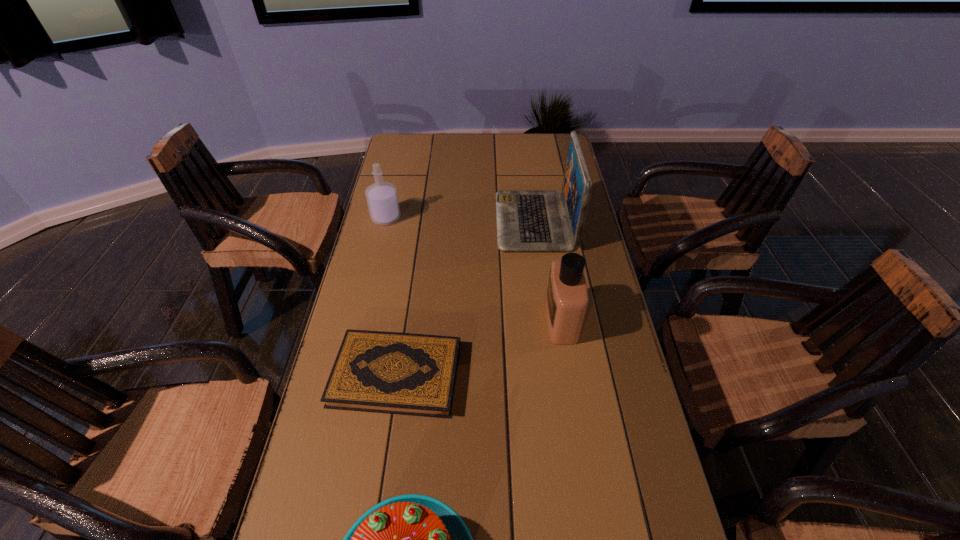
You are a GUI agent. You are given a task and a screenshot of the screen. Output one action in this format:
    pyautogui.click(x=<x>, y=<y>)
    Task: Click on the laptop computer
    
    Given the screenshot: What is the action you would take?
    pyautogui.click(x=527, y=220)

I want to click on the right perfume, so click(566, 303).

The width and height of the screenshot is (960, 540). Identify the location of the left perfume. (382, 199).

Locate an element on the screen. This screenshot has width=960, height=540. the shortest object is located at coordinates (412, 374).

Locate an element on the screen. free space located 0.280m on the screen of the laptop computer is located at coordinates (415, 221).

Find the location of a particular element. free space located on the screen of the laptop computer is located at coordinates coord(438,221).

Find the location of `vacant space situated 0.230m on the screen of the laptop computer`. vacant space situated 0.230m on the screen of the laptop computer is located at coordinates (429, 221).

What are the coordinates of `free space located on the front label of the right perfume` in the screenshot? It's located at (488, 320).

Locate an element on the screen. The height and width of the screenshot is (540, 960). vacant space positioned on the front label of the right perfume is located at coordinates (447, 320).

The width and height of the screenshot is (960, 540). I want to click on vacant space located on the front label of the right perfume, so click(x=422, y=320).